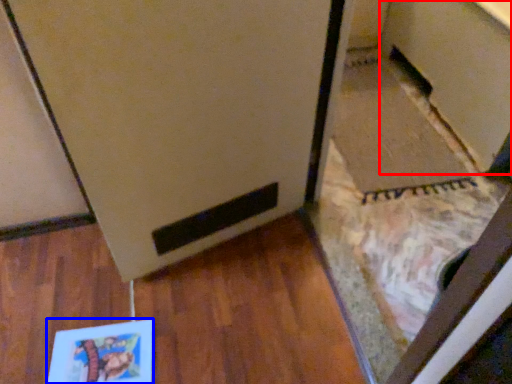
Question: Which of the following is the farthest to the observer, cabinetry (highlighted by a red box) or book (highlighted by a blue box)?

Choices:
 (A) cabinetry
 (B) book

Answer: (A)